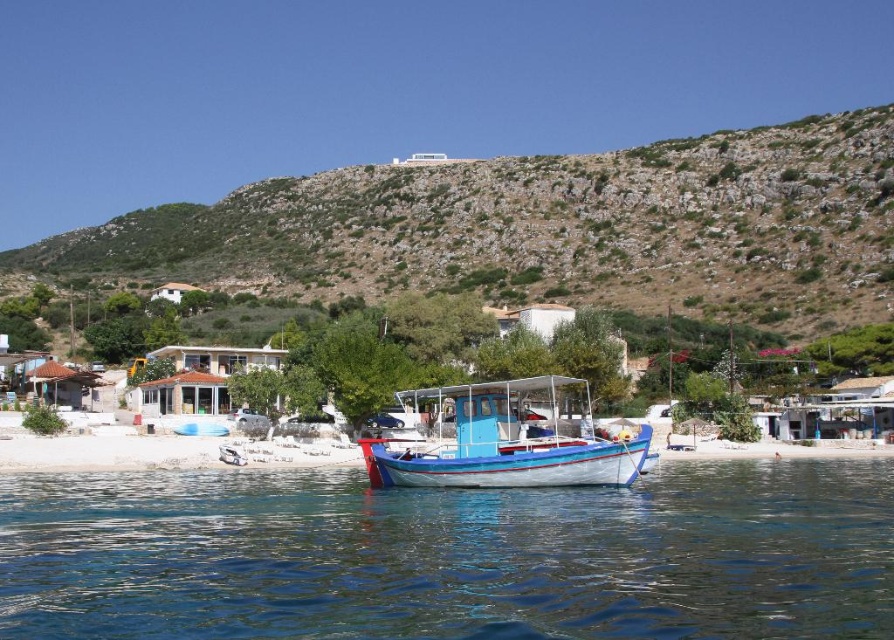
You are planning to build a small boat dock that needs to extend into the clear blue water at center. Considering the width of the brown rocky hillside at upper center, will the dock fit if it is designed to be as wide as the water area?

The clear blue water at center is narrower than the brown rocky hillside at upper center, so the dock designed to match the water area width will fit within the available space.

You are standing on the white sand beach at lower center and want to reach the clear blue water at center. Which direction should you walk to get there?

You should walk upward because the clear blue water at center is below the white sand beach at lower center, so moving upward from the beach will lead you towards the water.